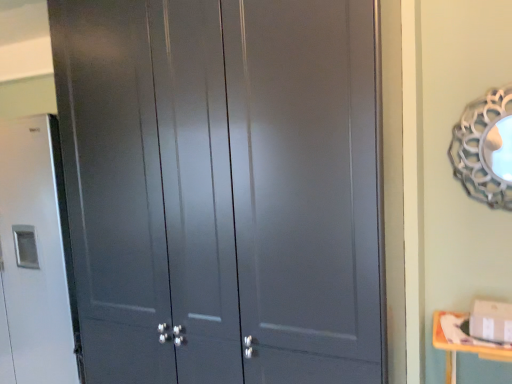
Where is `matte gray cabinet at center`? The image size is (512, 384). matte gray cabinet at center is located at coordinates (222, 188).

Image resolution: width=512 pixels, height=384 pixels. Describe the element at coordinates (113, 188) in the screenshot. I see `matte gray cabinet at left` at that location.

At what (x,y) coordinates should I click in order to perform the action: click on yellow wood changing table at lower right. Please return your answer as a coordinate pair (x, y). This screenshot has height=384, width=512. Looking at the image, I should click on (462, 347).

Identify the location of matte gray cabinet at center. This screenshot has width=512, height=384. (222, 188).

You are a GUI agent. You are given a task and a screenshot of the screen. Output one action in this format:
    pyautogui.click(x=<x>, y=<y>)
    Task: Click on the screen door located below the matte gray cabinet at center (from the image's perspective)
    The height and width of the screenshot is (384, 512).
    Given the screenshot: What is the action you would take?
    pyautogui.click(x=113, y=188)

Between matte gray cabinet at left and matte gray cabinet at center, which one has smaller width?

Thinner between the two is matte gray cabinet at center.

Is matte gray cabinet at left far from matte gray cabinet at center?

Actually, matte gray cabinet at left and matte gray cabinet at center are a little close together.

Would you say matte gray cabinet at center is part of matte gray cabinet at left's contents?

No, matte gray cabinet at left does not contain matte gray cabinet at center.

Locate an element on the screen. The height and width of the screenshot is (384, 512). screen door that is on the left side of metallic silver mirror at upper right is located at coordinates (113, 188).

Between metallic silver mirror at upper right and matte gray cabinet at left, which one has larger width?

matte gray cabinet at left is wider.

Which object is positioned more to the right, metallic silver mirror at upper right or matte gray cabinet at left?

metallic silver mirror at upper right is more to the right.

Which point is more distant from viewer, (502, 193) or (142, 341)?

Point (502, 193)

Which is in front, point (228, 26) or point (455, 374)?

The point (228, 26) is in front.

Considering the sizes of matte gray cabinet at center and yellow wood changing table at lower right in the image, is matte gray cabinet at center bigger or smaller than yellow wood changing table at lower right?

Clearly, matte gray cabinet at center is larger in size than yellow wood changing table at lower right.

In the scene shown: From a real-world perspective, does matte gray cabinet at center stand above yellow wood changing table at lower right?

Yes.

Which object is wider, matte gray cabinet at center or yellow wood changing table at lower right?

Wider between the two is matte gray cabinet at center.

Is there a large distance between metallic silver mirror at upper right and matte gray cabinet at center?

Yes.

From the image's perspective, does metallic silver mirror at upper right appear lower than matte gray cabinet at center?

No.

Does point (498, 159) appear closer or farther from the camera than point (192, 346)?

Clearly, point (498, 159) is more distant from the camera than point (192, 346).

Can matte gray cabinet at center be found inside metallic silver mirror at upper right?

Definitely not — matte gray cabinet at center is not inside metallic silver mirror at upper right.

Does matte gray cabinet at left have a lesser width compared to yellow wood changing table at lower right?

In fact, matte gray cabinet at left might be wider than yellow wood changing table at lower right.

Is matte gray cabinet at left facing towards yellow wood changing table at lower right?

No, matte gray cabinet at left is not aimed at yellow wood changing table at lower right.

Is the position of matte gray cabinet at left less distant than that of yellow wood changing table at lower right?

No, it is not.

Does matte gray cabinet at left have a greater height compared to yellow wood changing table at lower right?

Yes, matte gray cabinet at left is taller than yellow wood changing table at lower right.

Is yellow wood changing table at lower right far away from matte gray cabinet at center?

Absolutely, yellow wood changing table at lower right is distant from matte gray cabinet at center.

Is yellow wood changing table at lower right oriented away from matte gray cabinet at center?

yellow wood changing table at lower right does not have its back to matte gray cabinet at center.

Considering the sizes of objects yellow wood changing table at lower right and matte gray cabinet at center in the image provided, who is wider, yellow wood changing table at lower right or matte gray cabinet at center?

With larger width is matte gray cabinet at center.

Do you think yellow wood changing table at lower right is within matte gray cabinet at center, or outside of it?

The correct answer is: outside.

Consider the image. From the image's perspective, is matte gray cabinet at center below metallic silver mirror at upper right?

Yes, from the image's perspective, matte gray cabinet at center is below metallic silver mirror at upper right.

Which of these two, matte gray cabinet at center or metallic silver mirror at upper right, is bigger?

With larger size is matte gray cabinet at center.

Is matte gray cabinet at center not near metallic silver mirror at upper right?

Yes, matte gray cabinet at center and metallic silver mirror at upper right are located far from each other.

Is matte gray cabinet at center oriented towards metallic silver mirror at upper right?

No.

This screenshot has width=512, height=384. What are the coordinates of `door above the matte gray cabinet at left (from the image's perspective)` in the screenshot? It's located at coord(222,188).

Locate an element on the screen. This screenshot has width=512, height=384. mirror in front of the matte gray cabinet at left is located at coordinates (485, 149).

Looking at the image, which one is located closer to matte gray cabinet at center, metallic silver mirror at upper right or matte gray cabinet at left?

matte gray cabinet at left lies closer to matte gray cabinet at center than the other object.

From the image, which object appears to be nearer to matte gray cabinet at left, yellow wood changing table at lower right or matte gray cabinet at center?

matte gray cabinet at center is closer to matte gray cabinet at left.

When comparing their distances from matte gray cabinet at center, does metallic silver mirror at upper right or yellow wood changing table at lower right seem closer?

Among the two, metallic silver mirror at upper right is located nearer to matte gray cabinet at center.

In the scene shown: Looking at the image, which one is located further to metallic silver mirror at upper right, matte gray cabinet at left or matte gray cabinet at center?

matte gray cabinet at left is positioned further to the anchor metallic silver mirror at upper right.

Based on their spatial positions, is matte gray cabinet at center or yellow wood changing table at lower right further from matte gray cabinet at left?

yellow wood changing table at lower right is positioned further to the anchor matte gray cabinet at left.

Estimate the real-world distances between objects in this image. Which object is further from metallic silver mirror at upper right, yellow wood changing table at lower right or matte gray cabinet at left?

matte gray cabinet at left lies further to metallic silver mirror at upper right than the other object.

Considering their positions, is metallic silver mirror at upper right positioned further to matte gray cabinet at left than yellow wood changing table at lower right?

metallic silver mirror at upper right lies further to matte gray cabinet at left than the other object.

Which object lies further to the anchor point yellow wood changing table at lower right, matte gray cabinet at center or metallic silver mirror at upper right?

Based on the image, matte gray cabinet at center appears to be further to yellow wood changing table at lower right.

Where is `changing table located between matte gray cabinet at center and metallic silver mirror at upper right in the left-right direction`? changing table located between matte gray cabinet at center and metallic silver mirror at upper right in the left-right direction is located at coordinates (462, 347).

Find the location of a particular element. door situated between matte gray cabinet at left and metallic silver mirror at upper right from left to right is located at coordinates (222, 188).

You are a GUI agent. You are given a task and a screenshot of the screen. Output one action in this format:
    pyautogui.click(x=<x>, y=<y>)
    Task: Click on the door located between matte gray cabinet at left and yellow wood changing table at lower right in the left-right direction
    This screenshot has width=512, height=384.
    Given the screenshot: What is the action you would take?
    pyautogui.click(x=222, y=188)

Find the location of a particular element. Image resolution: width=512 pixels, height=384 pixels. changing table between matte gray cabinet at left and metallic silver mirror at upper right from left to right is located at coordinates (462, 347).